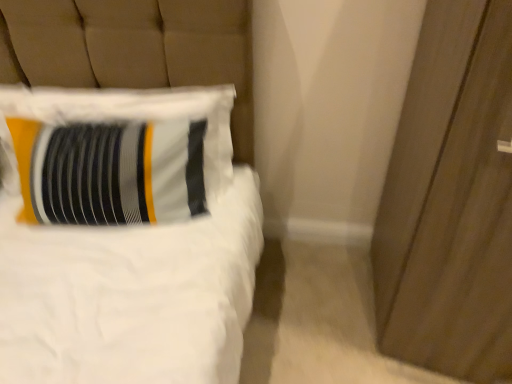
In order to click on white fabric pillow at left in this screenshot , I will do `click(119, 153)`.

What do you see at coordinates (119, 153) in the screenshot? Image resolution: width=512 pixels, height=384 pixels. I see `white fabric pillow at left` at bounding box center [119, 153].

This screenshot has height=384, width=512. Identify the location of white fabric pillow at left. (119, 153).